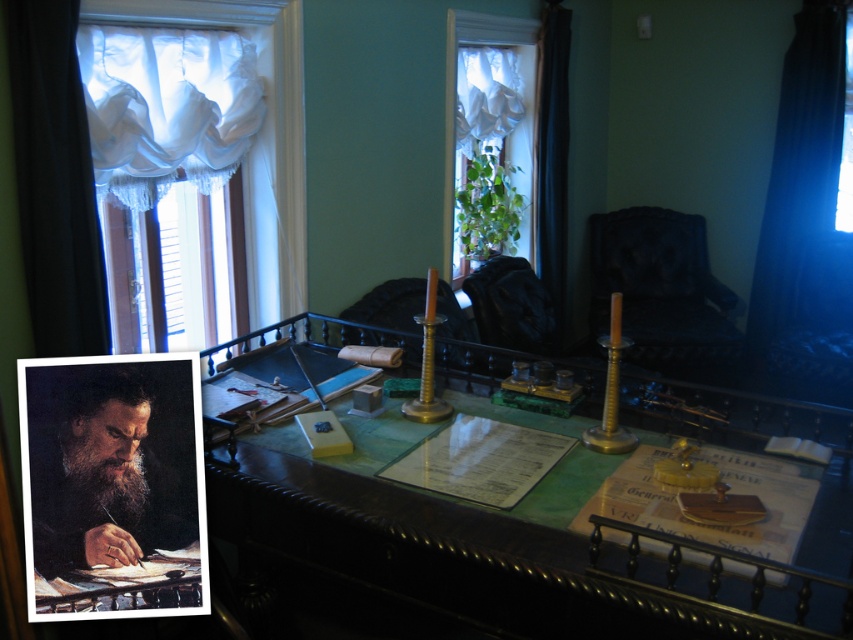
Between point (804, 33) and point (553, 60), which one is positioned behind?

The point (804, 33) is more distant.

Does point (778, 312) come behind point (550, 227)?

Yes, it is behind point (550, 227).

The width and height of the screenshot is (853, 640). What do you see at coordinates (799, 166) in the screenshot?
I see `dark blue fabric curtain at right` at bounding box center [799, 166].

Where is `dark blue fabric curtain at right`? The height and width of the screenshot is (640, 853). dark blue fabric curtain at right is located at coordinates (799, 166).

Can you confirm if black leather armchair at center is positioned above brown leather armchair at center?

Yes.

Consider the image. How distant is black leather armchair at center from brown leather armchair at center?

black leather armchair at center is 13.93 inches away from brown leather armchair at center.

This screenshot has height=640, width=853. What do you see at coordinates (512, 305) in the screenshot?
I see `black leather armchair at center` at bounding box center [512, 305].

Image resolution: width=853 pixels, height=640 pixels. I want to click on black leather armchair at center, so click(512, 305).

Can you confirm if dark blue fabric curtain at right is wider than transparent glass window at upper right?

In fact, dark blue fabric curtain at right might be narrower than transparent glass window at upper right.

Which of these two, dark blue fabric curtain at right or transparent glass window at upper right, stands shorter?

transparent glass window at upper right is shorter.

Between point (793, 275) and point (845, 33), which one is positioned behind?

Positioned behind is point (793, 275).

The height and width of the screenshot is (640, 853). What are the coordinates of `dark blue fabric curtain at right` in the screenshot? It's located at (799, 166).